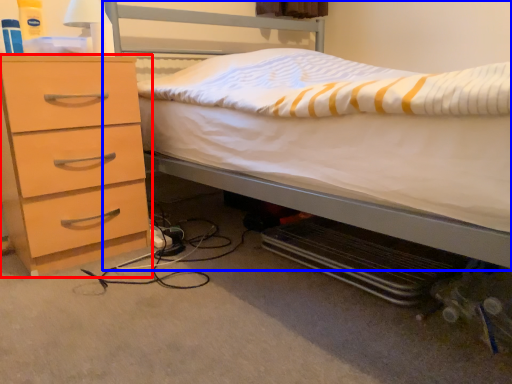
Question: Which point is closer to the camera, chest of drawers (highlighted by a red box) or bed (highlighted by a blue box)?

Choices:
 (A) chest of drawers
 (B) bed

Answer: (B)